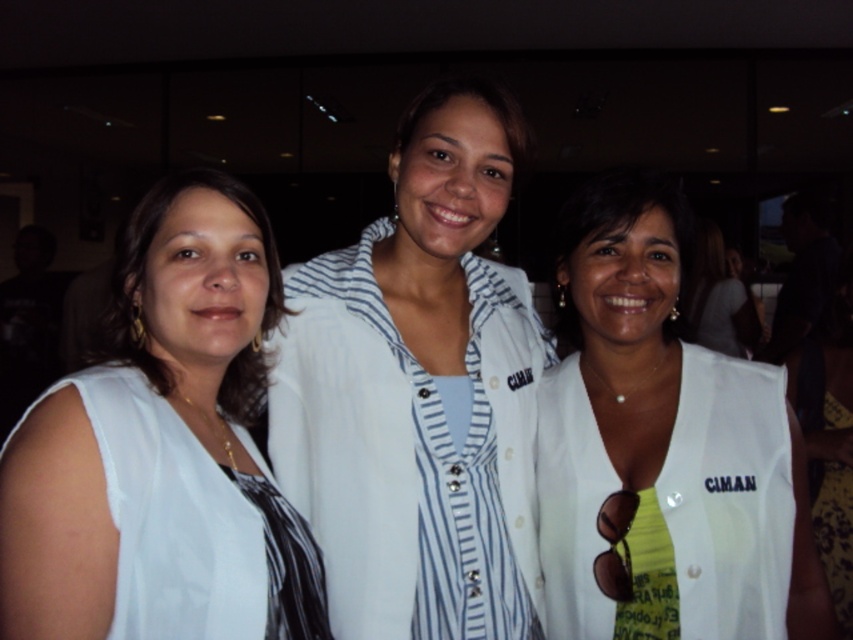
Question: Is white fabric at left smaller than patterned fabric dress at center?

Choices:
 (A) yes
 (B) no

Answer: (B)

Question: Which is farther from the white matte vest at center?

Choices:
 (A) white fabric at left
 (B) white fabric shirt at center

Answer: (B)

Question: Based on their relative distances, which object is nearer to the white striped shirt at center?

Choices:
 (A) white fabric at left
 (B) patterned fabric dress at center
 (C) white fabric shirt at center
 (D) white matte vest at center

Answer: (D)

Question: Is white fabric vest at center thinner than patterned fabric dress at center?

Choices:
 (A) yes
 (B) no

Answer: (B)

Question: Is white striped shirt at center thinner than white fabric at left?

Choices:
 (A) no
 (B) yes

Answer: (A)

Question: Which object is closer to the camera taking this photo?

Choices:
 (A) white striped shirt at center
 (B) patterned fabric dress at center
 (C) white matte vest at center
 (D) white fabric shirt at center

Answer: (A)